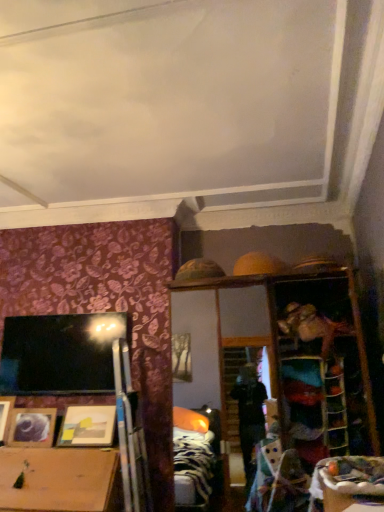
Question: From the image's perspective, is wooden picture frame at lower left, positioned as the first picture frame in left-to-right order, located above or below matte wooden picture frame at lower left, arranged as the first picture frame when viewed from the right?

Choices:
 (A) above
 (B) below

Answer: (B)

Question: Considering the positions of wooden picture frame at lower left, positioned as the first picture frame in left-to-right order, and matte wooden picture frame at lower left, arranged as the 3th picture frame when viewed from the left, in the image, is wooden picture frame at lower left, positioned as the first picture frame in left-to-right order, taller or shorter than matte wooden picture frame at lower left, arranged as the 3th picture frame when viewed from the left,?

Choices:
 (A) short
 (B) tall

Answer: (B)

Question: Which of these objects is positioned closest to the matte wooden picture frame at lower left, arranged as the second picture frame when viewed from the right?

Choices:
 (A) wooden picture frame at lower left, positioned as the first picture frame in left-to-right order
 (B) wooden table at lower right
 (C) matte wooden picture frame at lower left, arranged as the first picture frame when viewed from the right

Answer: (A)

Question: Which of these objects is positioned closest to the matte wooden picture frame at lower left, arranged as the second picture frame when viewed from the right?

Choices:
 (A) wooden picture frame at lower left, positioned as the first picture frame in left-to-right order
 (B) wooden table at lower right
 (C) matte wooden picture frame at lower left, arranged as the 3th picture frame when viewed from the left

Answer: (A)